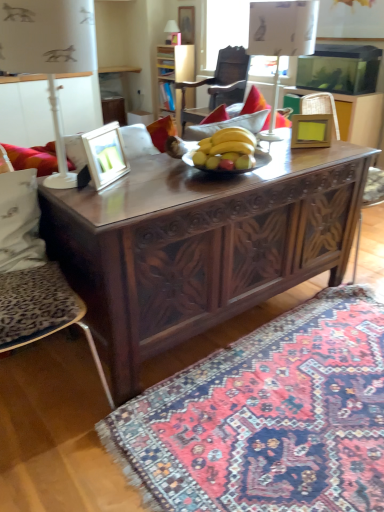
At what (x,y) coordinates should I click in order to perform the action: click on free region on the left part of matte wooden picture frame at left, the first picture frame positioned from the front. Please return your answer as a coordinate pair (x, y). This screenshot has height=512, width=384. Looking at the image, I should click on (64, 178).